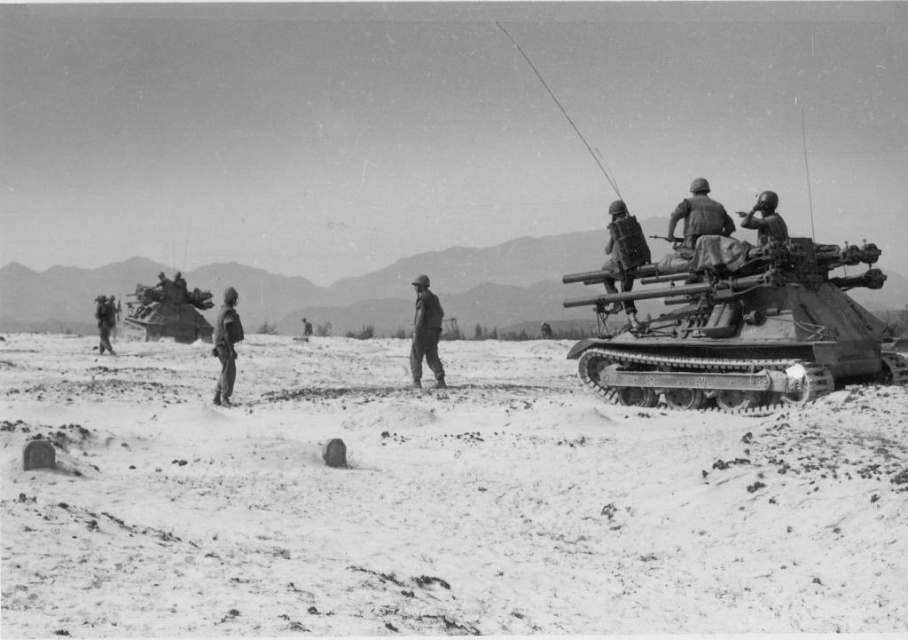
Is matte black helmet at center thinner than metallic helmet at upper right?

Incorrect, matte black helmet at center's width is not less than metallic helmet at upper right's.

Can you confirm if matte black helmet at center is positioned to the right of metallic helmet at upper right?

No, matte black helmet at center is not to the right of metallic helmet at upper right.

Find the location of `matte black helmet at center`. matte black helmet at center is located at coordinates (425, 332).

This screenshot has width=908, height=640. What do you see at coordinates (169, 308) in the screenshot?
I see `shiny metallic tank at left` at bounding box center [169, 308].

Which of these two, shiny metallic tank at left or camouflage fabric helmet at left, stands shorter?

camouflage fabric helmet at left is shorter.

Describe the element at coordinates (169, 308) in the screenshot. I see `shiny metallic tank at left` at that location.

Identify the location of shiny metallic tank at left. (169, 308).

Is metallic helmet at upper right below camouflage fabric helmet at left?

No.

This screenshot has height=640, width=908. Identify the location of metallic helmet at upper right. (765, 220).

Where is `metallic helmet at upper right`? metallic helmet at upper right is located at coordinates (765, 220).